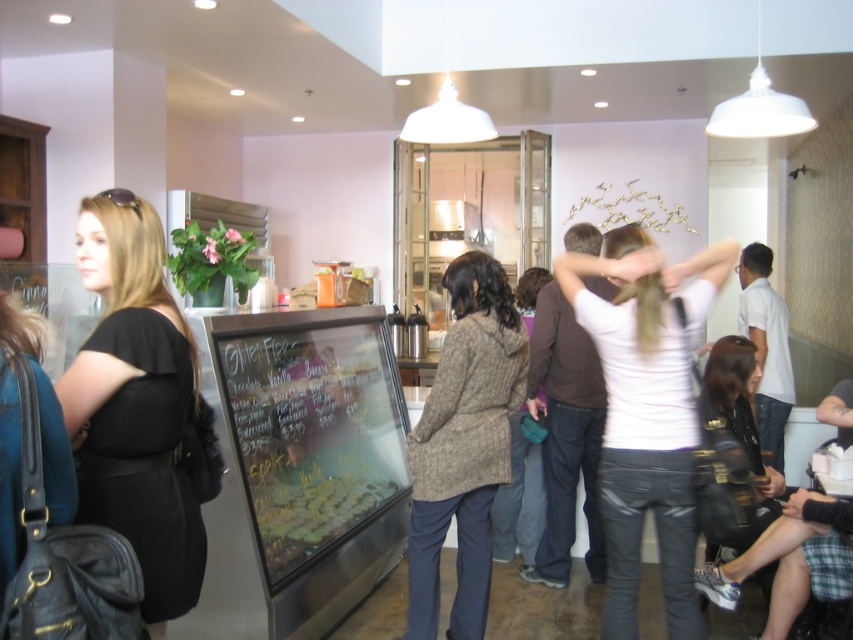
You are a customer in the bakery and want to read the menu. The black glass menu board at center and the black matte dress at left are both in your line of sight. Which object is wider?

The black glass menu board at center is wider than the black matte dress at left as its width surpasses the dress.

You are a customer trying to reach the counter in the bakery. There are two points marked on the floor, one at point (367,509) and another at point (131,328). Which point should you step on first to move closer to the counter?

You should step on point (131,328) first because it is closer to the counter than point (367,509), which is further away from the counter.

You are a customer in this bakery and you want to check the price of the gluten free cookies. You see a white matte shirt at center and a knitted wool coat at center. Which one is closer to your eyes?

The white matte shirt at center is located above the knitted wool coat at center, so it is closer to your eyes.